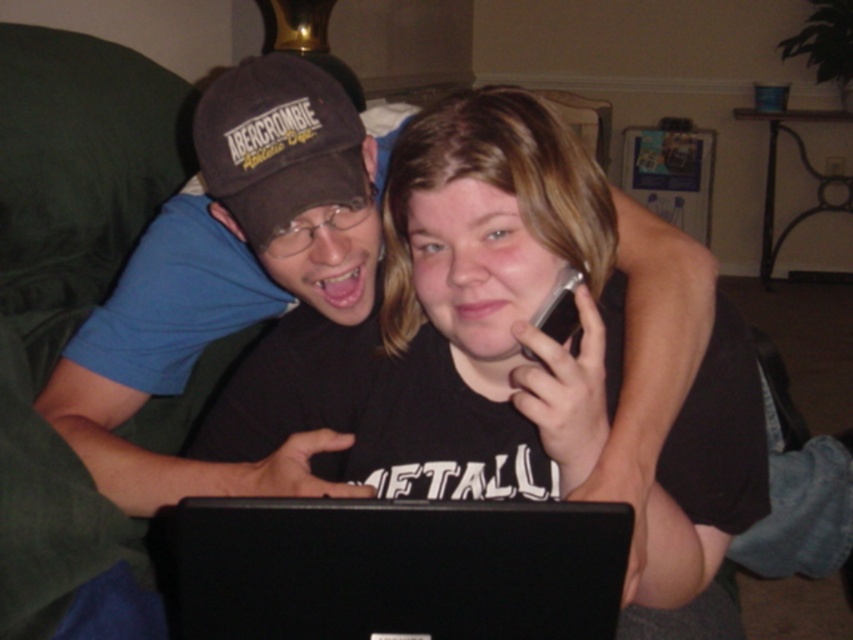
You are a photographer trying to capture a candid shot of two friends. You notice the silver metallic phone at upper center and the dark brown fabric baseball cap at upper left. Which object is closer to the camera?

The dark brown fabric baseball cap at upper left is closer to the camera because the silver metallic phone at upper center is behind it.

Based on the photo, you are a photographer adjusting your camera settings to capture the scene. You notice the dark brown fabric baseball cap at upper left and the silver metallic phone at upper center. Which object should you focus on first if you want to ensure both are in sharp focus, considering their sizes in the frame?

The dark brown fabric baseball cap at upper left is much taller than the silver metallic phone at upper center, so focusing on the larger object first would help ensure both are in sharp focus.